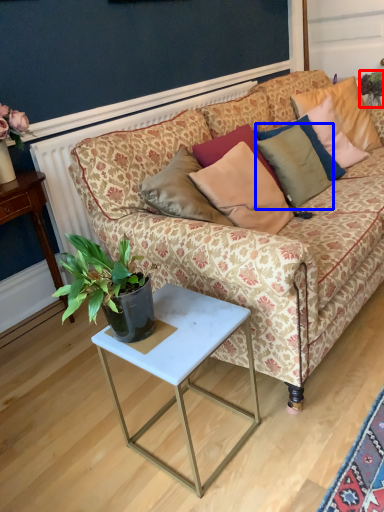
Question: Which object appears closest to the camera in this image, houseplant (highlighted by a red box) or pillow (highlighted by a blue box)?

Choices:
 (A) houseplant
 (B) pillow

Answer: (B)